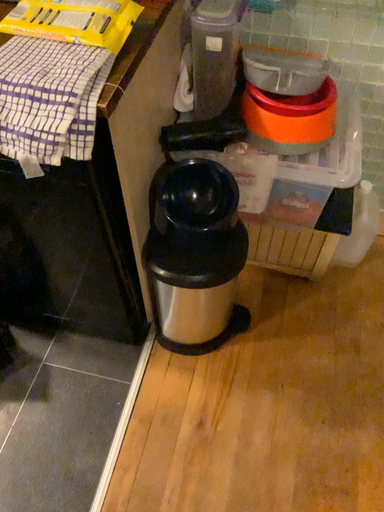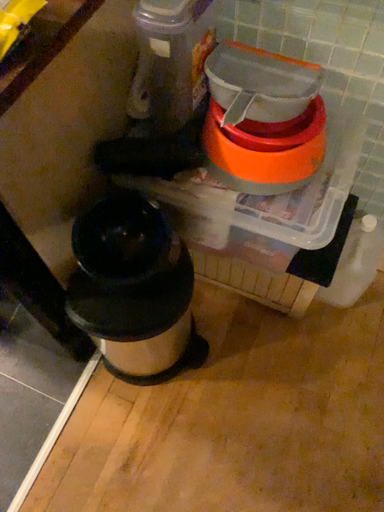
Question: How did the camera likely rotate when shooting the video?

Choices:
 (A) rotated upward
 (B) rotated downward

Answer: (B)